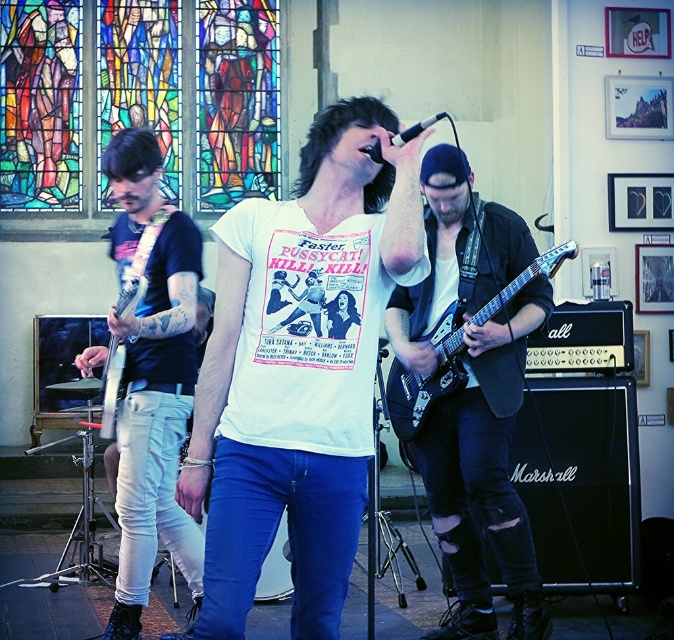
Question: Considering the relative positions of metallic silver electric guitar at left and black matte microphone at center in the image provided, where is metallic silver electric guitar at left located with respect to black matte microphone at center?

Choices:
 (A) above
 (B) below

Answer: (B)

Question: Which of these objects is positioned closest to the metallic silver electric guitar at left?

Choices:
 (A) shiny black electric guitar at center
 (B) white cotton t-shirt at center
 (C) white matte t-shirt at center

Answer: (C)

Question: Can you confirm if white matte t-shirt at center is smaller than metallic silver electric guitar at left?

Choices:
 (A) yes
 (B) no

Answer: (B)

Question: Which point is closer to the camera?

Choices:
 (A) metallic silver electric guitar at left
 (B) black matte microphone at center
 (C) matte black guitar at center
 (D) shiny black electric guitar at center

Answer: (B)

Question: Which point is closer to the camera?

Choices:
 (A) (367, 228)
 (B) (245, 131)
 (C) (266, 342)
 (D) (197, 592)

Answer: (C)

Question: Does dark blue jeans at left come behind metallic silver electric guitar at left?

Choices:
 (A) yes
 (B) no

Answer: (B)